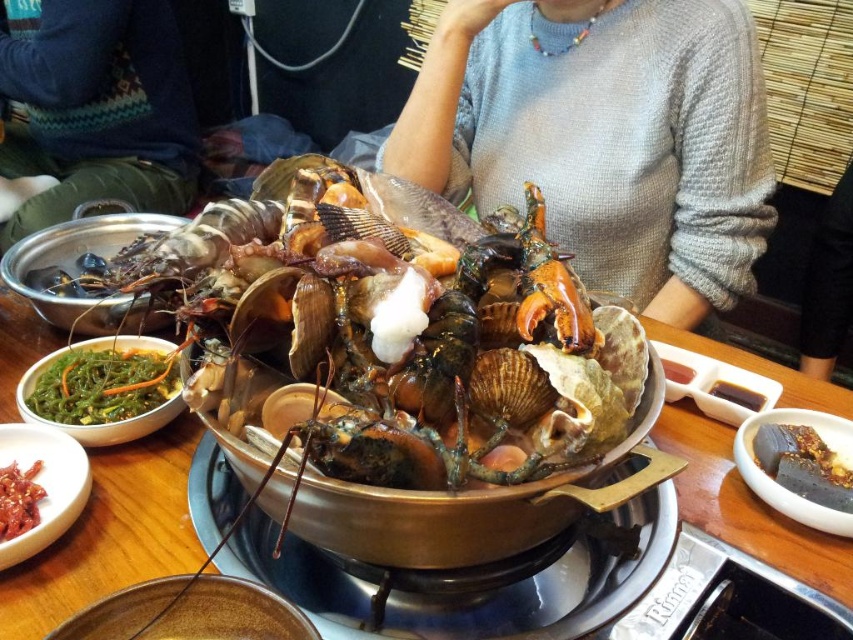
Is purple matte jelly at lower right closer to the viewer compared to white glossy rice at center?

That is True.

Locate an element on the screen. This screenshot has height=640, width=853. purple matte jelly at lower right is located at coordinates (804, 465).

Is green seaweed salad at lower left above purple matte jelly at lower right?

Yes, green seaweed salad at lower left is above purple matte jelly at lower right.

Is point (163, 388) in front of point (804, 497)?

That is False.

Where is `green seaweed salad at lower left`? green seaweed salad at lower left is located at coordinates [103, 385].

Is shiny red sauce at lower left in front of dark brown glossy sauce at center?

That is True.

Who is higher up, shiny red sauce at lower left or dark brown glossy sauce at center?

dark brown glossy sauce at center

Is point (30, 513) less distant than point (735, 387)?

Yes, point (30, 513) is in front of point (735, 387).

I want to click on shiny red sauce at lower left, so click(x=18, y=499).